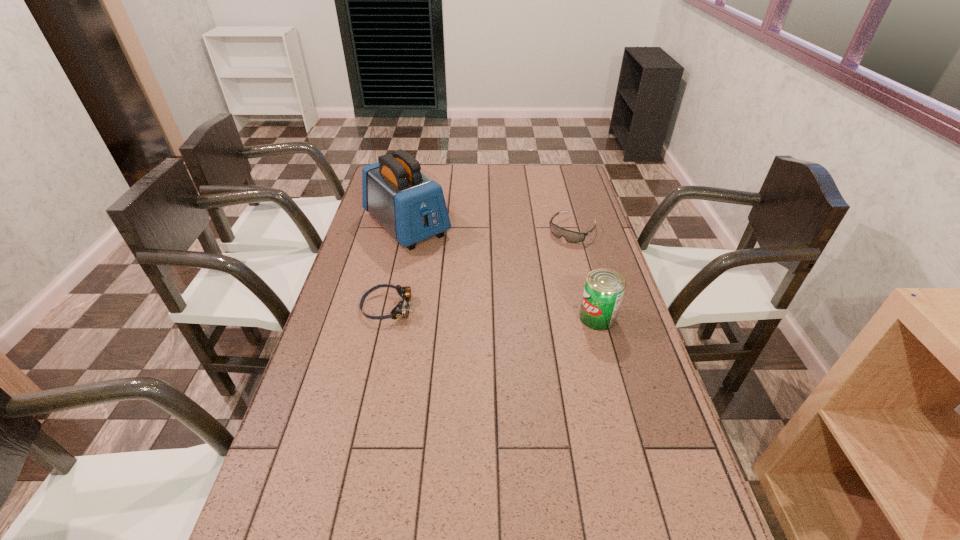
This screenshot has height=540, width=960. Identify the location of vacant space that is in between the tallest object and the right goggles. (490, 227).

Locate an element on the screen. Image resolution: width=960 pixels, height=540 pixels. free space that is in between the nearer goggles and the right goggles is located at coordinates (480, 268).

You are a GUI agent. You are given a task and a screenshot of the screen. Output one action in this format:
    pyautogui.click(x=<x>, y=<y>)
    Task: Click on the free space between the toaster and the farther goggles
    
    Given the screenshot: What is the action you would take?
    pyautogui.click(x=490, y=227)

This screenshot has height=540, width=960. I want to click on free space that is in between the third shortest object and the right goggles, so click(585, 274).

Locate an element on the screen. This screenshot has height=540, width=960. free space between the nearer goggles and the right goggles is located at coordinates 480,268.

Image resolution: width=960 pixels, height=540 pixels. Identify the location of free area in between the right goggles and the can. (585, 274).

Find the location of `unoccupied area between the tallest object and the left goggles`. unoccupied area between the tallest object and the left goggles is located at coordinates (397, 266).

You are a GUI agent. You are given a task and a screenshot of the screen. Output one action in this format:
    pyautogui.click(x=<x>, y=<y>)
    Task: Click on the vacant area between the toaster and the farther goggles
    This screenshot has height=540, width=960.
    Given the screenshot: What is the action you would take?
    pyautogui.click(x=490, y=227)

At what (x,y) coordinates should I click in order to perform the action: click on unoccupied area between the nearer goggles and the can. Please return your answer as a coordinate pair (x, y). Looking at the image, I should click on (492, 312).

The width and height of the screenshot is (960, 540). In order to click on free space between the farther goggles and the nearer goggles in this screenshot , I will do `click(480, 268)`.